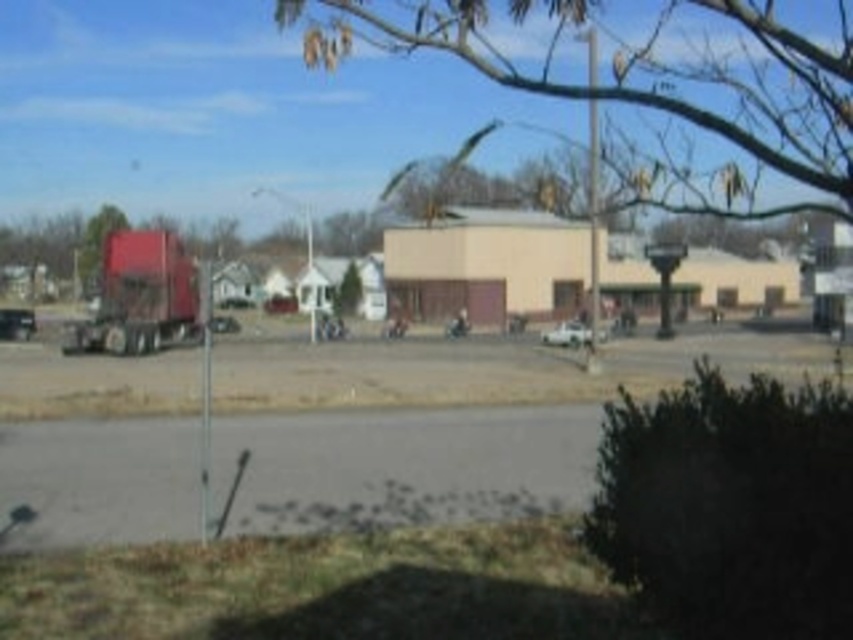
Question: Considering the relative positions of metallic silver truck at left and metallic silver car at center in the image provided, where is metallic silver truck at left located with respect to metallic silver car at center?

Choices:
 (A) right
 (B) left

Answer: (B)

Question: Is the position of dark green bush at lower right more distant than that of white matte car at center?

Choices:
 (A) no
 (B) yes

Answer: (A)

Question: Is matte red trailer truck at left behind green leafy tree at left?

Choices:
 (A) yes
 (B) no

Answer: (B)

Question: Which point appears closest to the camera in this image?

Choices:
 (A) (583, 333)
 (B) (602, 529)
 (C) (230, 321)
 (D) (352, 304)

Answer: (B)

Question: Estimate the real-world distances between objects in this image. Which object is farther from the green leafy tree at left?

Choices:
 (A) matte red trailer truck at left
 (B) metallic silver car at center
 (C) dark green bush at lower right
 (D) white matte car at center

Answer: (C)

Question: Which object is positioned closest to the white matte car at center?

Choices:
 (A) brown textured tree at center
 (B) metallic silver car at center
 (C) matte red trailer truck at left
 (D) green leafy tree at center

Answer: (C)